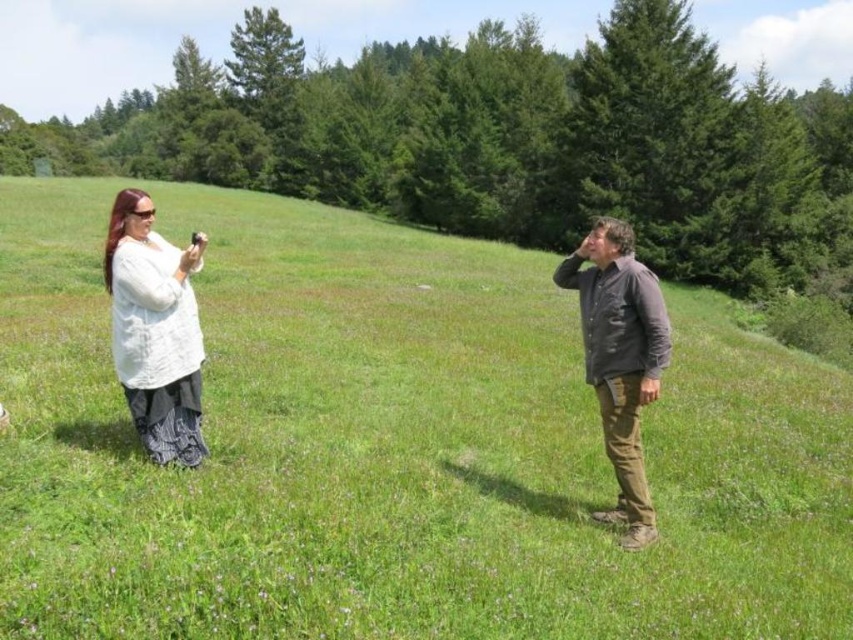
Question: Among these points, which one is nearest to the camera?

Choices:
 (A) (178, 256)
 (B) (570, 260)
 (C) (32, 552)

Answer: (C)

Question: Can you confirm if white textured shirt at left is thinner than dark brown leather jacket at center?

Choices:
 (A) no
 (B) yes

Answer: (B)

Question: Does white textured shirt at left appear on the right side of dark brown leather jacket at center?

Choices:
 (A) no
 (B) yes

Answer: (A)

Question: Which is farther from the green grassy field at center?

Choices:
 (A) white textured shirt at left
 (B) dark brown leather jacket at center

Answer: (A)

Question: Among these points, which one is farthest from the camera?

Choices:
 (A) tap(592, 609)
 (B) tap(624, 541)
 (C) tap(161, 292)

Answer: (B)

Question: Is green grassy field at center positioned in front of white textured shirt at left?

Choices:
 (A) no
 (B) yes

Answer: (B)